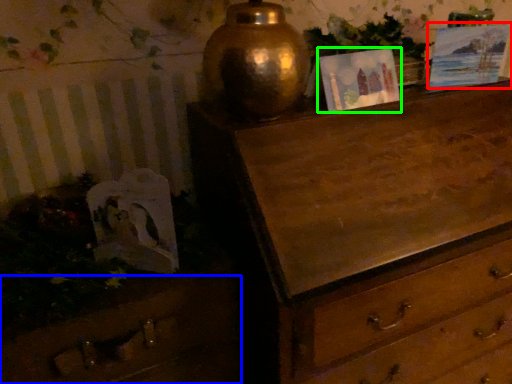
Question: Considering the real-world distances, which object is farthest from picture frame (highlighted by a red box)? drawer (highlighted by a blue box) or picture frame (highlighted by a green box)?

Choices:
 (A) drawer
 (B) picture frame

Answer: (A)